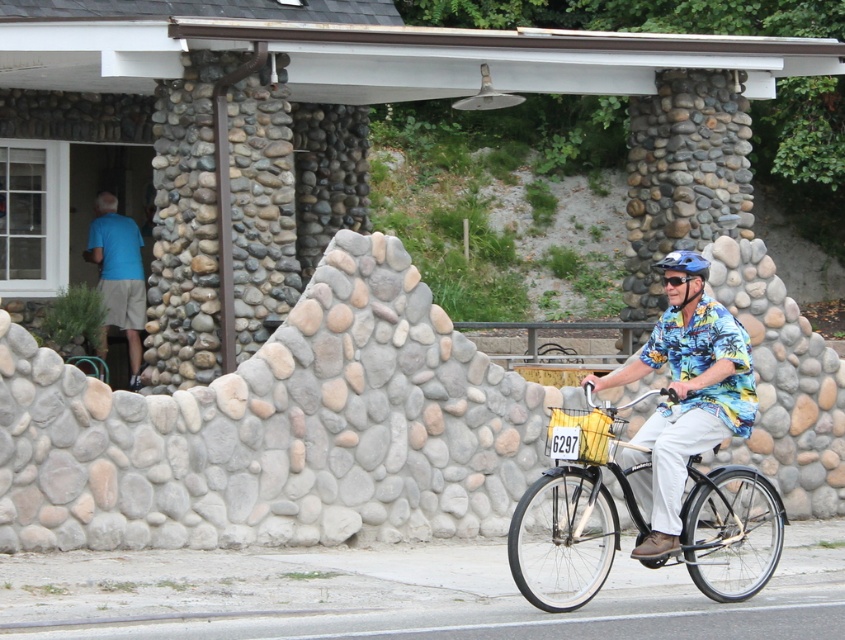
Which is behind, point (546, 477) or point (586, 445)?

The point (586, 445) is behind.

Is black matte bicycle at center bigger than yellow fabric basket at center?

Correct, black matte bicycle at center is larger in size than yellow fabric basket at center.

What do you see at coordinates (571, 520) in the screenshot?
I see `black matte bicycle at center` at bounding box center [571, 520].

Locate an element on the screen. black matte bicycle at center is located at coordinates (571, 520).

Is floral print shirt at center smaller than blue matte helmet at center?

Indeed, floral print shirt at center has a smaller size compared to blue matte helmet at center.

This screenshot has height=640, width=845. Describe the element at coordinates (685, 400) in the screenshot. I see `floral print shirt at center` at that location.

What are the coordinates of `floral print shirt at center` in the screenshot? It's located at 685,400.

Between point (597, 417) and point (690, 262), which one is positioned behind?

The point (690, 262) is behind.

Can you confirm if yellow fabric basket at center is smaller than blue matte helmet at center?

Correct, yellow fabric basket at center occupies less space than blue matte helmet at center.

Who is more distant from viewer, (579, 432) or (695, 268)?

The point (695, 268) is behind.

Where is `yellow fabric basket at center`? This screenshot has width=845, height=640. yellow fabric basket at center is located at coordinates (582, 435).